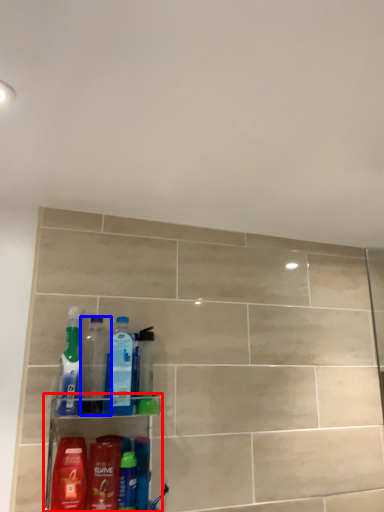
Question: Which point is closer to the camera, shelf (highlighted by a red box) or bottle (highlighted by a blue box)?

Choices:
 (A) shelf
 (B) bottle

Answer: (A)